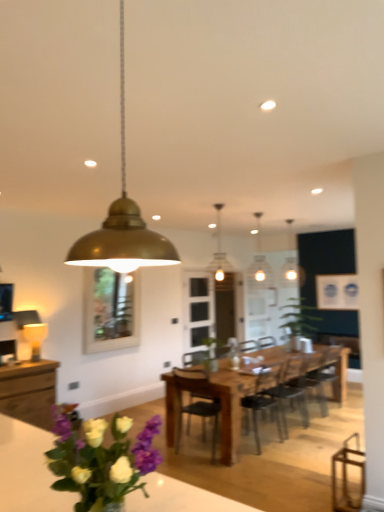
Describe the element at coordinates (339, 372) in the screenshot. Image resolution: width=384 pixels, height=512 pixels. I see `black leather chair at center, arranged as the 5th chair when viewed from the left` at that location.

The height and width of the screenshot is (512, 384). I want to click on metallic gold swivel chair at lower right, so click(x=348, y=476).

The width and height of the screenshot is (384, 512). Describe the element at coordinates (260, 260) in the screenshot. I see `white glass pendant light at center, the first lamp positioned from the right` at that location.

In order to face wooden cabinet at lower left, should I rotate leftwards or rightwards?

To face it directly, rotate left by 21.771 degrees.

This screenshot has height=512, width=384. Find the location of `black leather chair at center, marked as the first chair in a right-to-left arrangement`. black leather chair at center, marked as the first chair in a right-to-left arrangement is located at coordinates (339, 372).

In the image, is wooden chair at center, positioned as the 5th chair in right-to-left order, positioned in front of or behind matte gold pendant light at center, placed as the third lamp when sorted from left to right?

In the image, wooden chair at center, positioned as the 5th chair in right-to-left order, appears in front of matte gold pendant light at center, placed as the third lamp when sorted from left to right.

From a real-world perspective, is wooden chair at center, positioned as the 5th chair in right-to-left order, positioned above or below matte gold pendant light at center, which is the second lamp in front-to-back order?

Clearly, from a real-world perspective, wooden chair at center, positioned as the 5th chair in right-to-left order, is below matte gold pendant light at center, which is the second lamp in front-to-back order.

Does wooden chair at center, positioned as the 5th chair in right-to-left order, have a smaller size compared to matte gold pendant light at center, which is counted as the 2th lamp, starting from the right?

Incorrect, wooden chair at center, positioned as the 5th chair in right-to-left order, is not smaller in size than matte gold pendant light at center, which is counted as the 2th lamp, starting from the right.

Considering the positions of objects metallic gold swivel chair at lower right and wooden cabinet at lower left in the image provided, who is more to the right, metallic gold swivel chair at lower right or wooden cabinet at lower left?

metallic gold swivel chair at lower right is more to the right.

Based on the photo, how distant is metallic gold swivel chair at lower right from wooden cabinet at lower left?

metallic gold swivel chair at lower right and wooden cabinet at lower left are 3.05 meters apart.

Could you tell me if metallic gold swivel chair at lower right is turned towards wooden cabinet at lower left?

No, metallic gold swivel chair at lower right is not facing towards wooden cabinet at lower left.

Which point is more distant from viewer, (362, 451) or (49, 421)?

The point (49, 421) is farther.

In the scene shown: Which object is wider, green matte plant at center or matte gold pendant light at center, the 3th lamp positioned from the back?

green matte plant at center.

Is point (294, 336) behind point (226, 267)?

Yes, point (294, 336) is farther from viewer.

Between green matte plant at center and matte gold pendant light at center, the 3th lamp positioned from the back, which one appears on the right side from the viewer's perspective?

green matte plant at center is more to the right.

Based on the photo, from a real-world perspective, is green matte plant at center positioned over matte gold pendant light at center, which is the second lamp in front-to-back order, based on gravity?

No, from a real-world perspective, green matte plant at center is not over matte gold pendant light at center, which is the second lamp in front-to-back order

Which object is further away from the camera taking this photo, purple matte flower at lower left or wooden chair at center, positioned as the 5th chair in right-to-left order?

purple matte flower at lower left is further from the camera.

Is purple matte flower at lower left bigger than wooden chair at center, placed as the first chair when sorted from left to right?

Incorrect, purple matte flower at lower left is not larger than wooden chair at center, placed as the first chair when sorted from left to right.

Which of these two, purple matte flower at lower left or wooden chair at center, positioned as the 5th chair in right-to-left order, is thinner?

With smaller width is purple matte flower at lower left.

Who is shorter, purple matte flower at lower left or wooden chair at center, placed as the first chair when sorted from left to right?

Standing shorter between the two is purple matte flower at lower left.

Does gold metallic pendant light at upper center, which ranks as the 1th lamp in front-to-back order, have a greater width compared to wooden cabinet at lower left?

No, gold metallic pendant light at upper center, which ranks as the 1th lamp in front-to-back order, is not wider than wooden cabinet at lower left.

Considering the sizes of objects gold metallic pendant light at upper center, which ranks as the 1th lamp in front-to-back order, and wooden cabinet at lower left in the image provided, who is shorter, gold metallic pendant light at upper center, which ranks as the 1th lamp in front-to-back order, or wooden cabinet at lower left?

wooden cabinet at lower left is shorter.

Does gold metallic pendant light at upper center, which ranks as the 1th lamp in front-to-back order, turn towards wooden cabinet at lower left?

No.

Is gold metallic pendant light at upper center, which appears as the fourth lamp when viewed from the back, spatially inside wooden cabinet at lower left, or outside of it?

gold metallic pendant light at upper center, which appears as the fourth lamp when viewed from the back, is spatially situated outside wooden cabinet at lower left.

Does point (181, 420) appear closer or farther from the camera than point (229, 369)?

Point (181, 420) appears to be closer to the viewer than point (229, 369).

Can you see wooden chair at center, positioned as the 5th chair in right-to-left order, touching wooden dining table at center?

wooden chair at center, positioned as the 5th chair in right-to-left order, and wooden dining table at center are clearly separated.

From the image's perspective, which is below, wooden chair at center, positioned as the 5th chair in right-to-left order, or wooden dining table at center?

wooden dining table at center is shown below in the image.

Does wooden chair at center, placed as the first chair when sorted from left to right, have a smaller size compared to wooden dining table at center?

Yes.

Is clear glass door at center positioned before gold metallic pendant light at upper center, which ranks as the second lamp in left-to-right order?

No.

Based on the photo, is clear glass door at center inside the boundaries of gold metallic pendant light at upper center, which ranks as the 1th lamp in front-to-back order, or outside?

clear glass door at center is spatially situated outside gold metallic pendant light at upper center, which ranks as the 1th lamp in front-to-back order.

Can you confirm if clear glass door at center is shorter than gold metallic pendant light at upper center, the 3th lamp when ordered from right to left?

In fact, clear glass door at center may be taller than gold metallic pendant light at upper center, the 3th lamp when ordered from right to left.

From the image's perspective, does clear glass door at center appear lower than gold metallic pendant light at upper center, which ranks as the 1th lamp in front-to-back order?

Yes, from the image's perspective, clear glass door at center is beneath gold metallic pendant light at upper center, which ranks as the 1th lamp in front-to-back order.

This screenshot has width=384, height=512. I want to click on the 1st chair below the matte gold pendant light at center, placed as the third lamp when sorted from left to right (from the image's perspective), so click(195, 402).

What are the coordinates of `swivel chair that appears below the wooden cabinet at lower left (from a real-world perspective)` in the screenshot? It's located at (348, 476).

From the image, which object appears to be nearer to wooden chair at center, which appears as the second chair when viewed from the left, metallic gold swivel chair at lower right or gold metallic pendant light at upper center, which appears as the fourth lamp when viewed from the back?

Based on the image, metallic gold swivel chair at lower right appears to be nearer to wooden chair at center, which appears as the second chair when viewed from the left.

Considering their positions, is white glass pendant light at center, the first lamp positioned from the right, positioned closer to purple matte flower at lower left than wooden chair at center, which appears as the second chair when viewed from the left?

wooden chair at center, which appears as the second chair when viewed from the left.

Looking at the image, which one is located closer to purple matte flower at lower left, matte gold pendant light at center, which is counted as the 2th lamp, starting from the right, or black leather chair at center, arranged as the 5th chair when viewed from the left?

The object closer to purple matte flower at lower left is matte gold pendant light at center, which is counted as the 2th lamp, starting from the right.

Based on their spatial positions, is purple matte flower at lower left or clear glass window at center further from metallic gold swivel chair at lower right?

clear glass window at center is further to metallic gold swivel chair at lower right.

Estimate the real-world distances between objects in this image. Which object is closer to wooden dining table at center, wooden chair at center, which appears as the second chair when viewed from the left, or clear glass window at center?

Among the two, wooden chair at center, which appears as the second chair when viewed from the left, is located nearer to wooden dining table at center.

Estimate the real-world distances between objects in this image. Which object is further from purple matte flower at lower left, metallic gold swivel chair at lower right or green matte plant at center?

green matte plant at center.

Considering their positions, is wooden chair at center, placed as the first chair when sorted from left to right, positioned further to clear glass door at center than wooden chair at center, which appears as the second chair when viewed from the left?

wooden chair at center, placed as the first chair when sorted from left to right, is positioned further to the anchor clear glass door at center.

Based on their spatial positions, is black leather chair at center, marked as the first chair in a right-to-left arrangement, or matte gold pendant light at center, the 3th lamp positioned from the back, closer to gold metallic pendant light at upper center, the 3th lamp when ordered from right to left?

black leather chair at center, marked as the first chair in a right-to-left arrangement, lies closer to gold metallic pendant light at upper center, the 3th lamp when ordered from right to left, than the other object.

The width and height of the screenshot is (384, 512). Identify the location of houseplant between wooden chair at center, placed as the first chair when sorted from left to right, and clear glass door at center in the front-back direction. (299, 318).

Identify the location of chair between white glass pendant light at center, acting as the 4th lamp starting from the left, and clear glass door at center, along the z-axis. (339, 372).

Identify the location of cabinetry between metallic gold swivel chair at lower right and clear glass door at center along the z-axis. (29, 391).

This screenshot has width=384, height=512. Identify the location of window situated between matte gold lampshade at left, the 4th lamp when ordered from right to left, and wooden dining table at center from left to right. (110, 310).